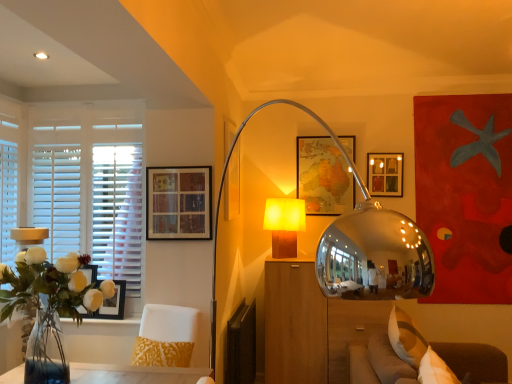
Question: Is wooden dresser at center in front of or behind white fabric pillow at lower right in the image?

Choices:
 (A) front
 (B) behind

Answer: (B)

Question: Is wooden dresser at center wider or thinner than white fabric pillow at lower right?

Choices:
 (A) wide
 (B) thin

Answer: (A)

Question: Estimate the real-world distances between objects in this image. Which object is farther from the matte black picture frame at upper center, which is the third picture frame from left to right?

Choices:
 (A) soft beige fabric couch at lower right
 (B) matte wooden picture frame at upper left, arranged as the fifth picture frame when viewed from the back
 (C) white fabric pillow at lower right
 (D) wooden dresser at center
 (E) wooden block lamp at center

Answer: (A)

Question: Considering the real-world distances, which object is closest to the white fabric swivel chair at lower left?

Choices:
 (A) matte black picture frame at left, which is counted as the fourth picture frame, starting from the back
 (B) matte wooden picture frame at upper left, which appears as the second picture frame when viewed from the left
 (C) clear glass vase at left
 (D) wooden dresser at center
 (E) matte wooden picture frame at center, the 2th picture frame in the right-to-left sequence

Answer: (A)